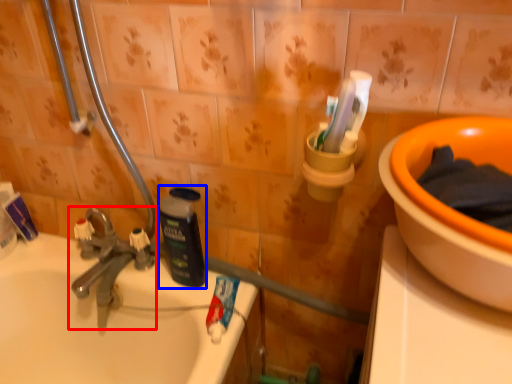
Question: Which of the following is the farthest to the observer, tap (highlighted by a red box) or bottle (highlighted by a blue box)?

Choices:
 (A) tap
 (B) bottle

Answer: (A)